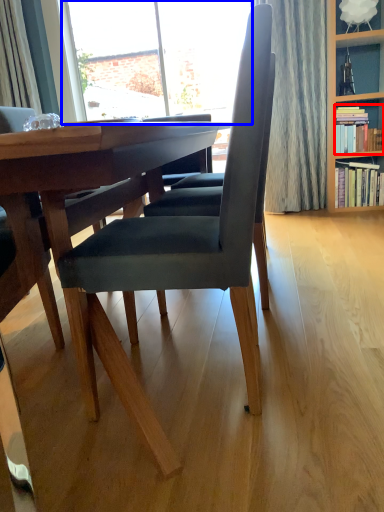
Question: Which of the following is the farthest to the observer, book (highlighted by a red box) or window (highlighted by a blue box)?

Choices:
 (A) book
 (B) window

Answer: (B)